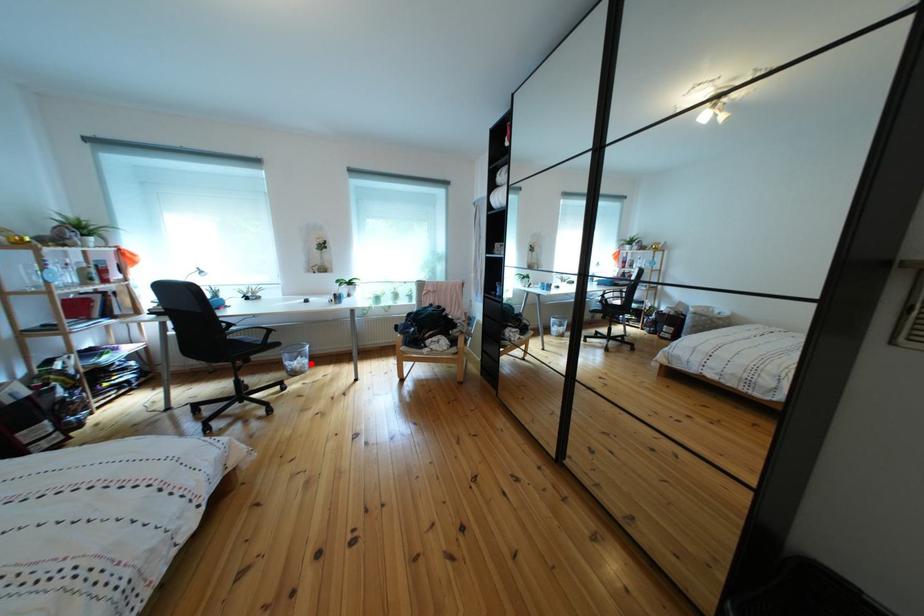
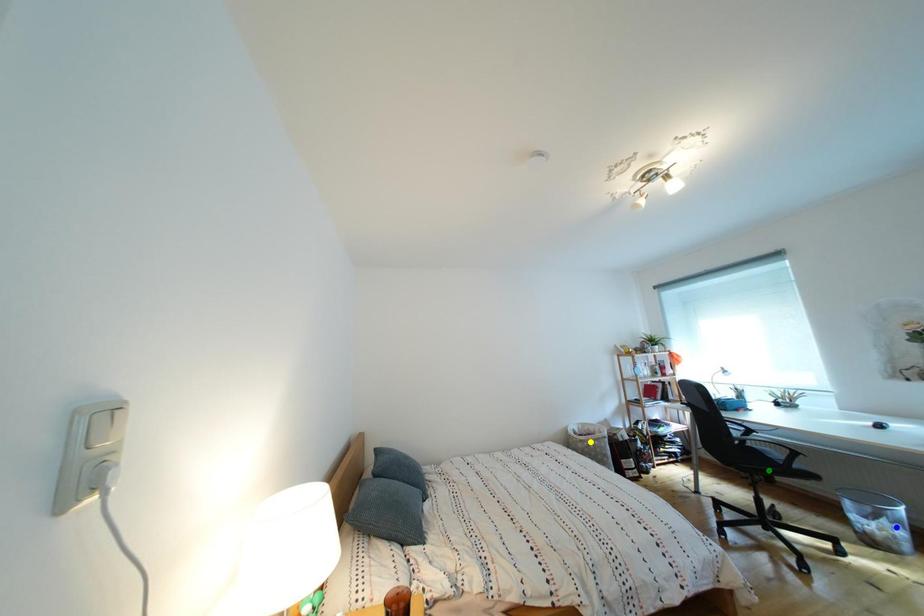
Question: I am providing you with two images of the same scene from different viewpoints. A red point is marked on the first image. You are given multiple points on the second image. Which mark in image 2 goes with the point in image 1?

Choices:
 (A) green point
 (B) blue point
 (C) yellow point

Answer: (B)